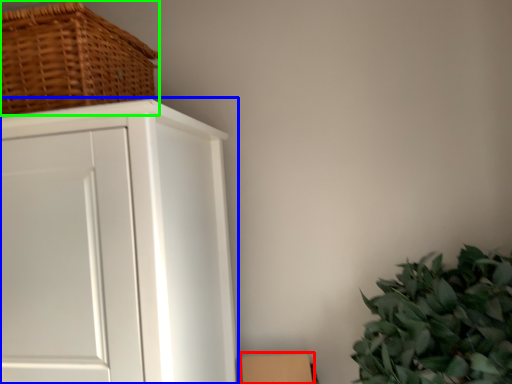
Question: Which object is the farthest from cardboard box (highlighted by a red box)? Choose among these: cupboard (highlighted by a blue box) or basket (highlighted by a green box).

Choices:
 (A) cupboard
 (B) basket

Answer: (B)